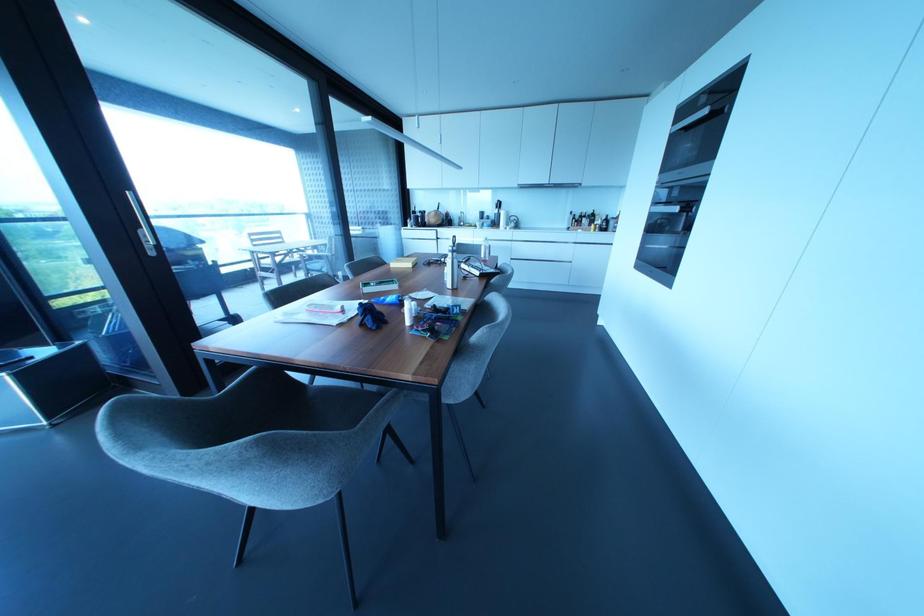
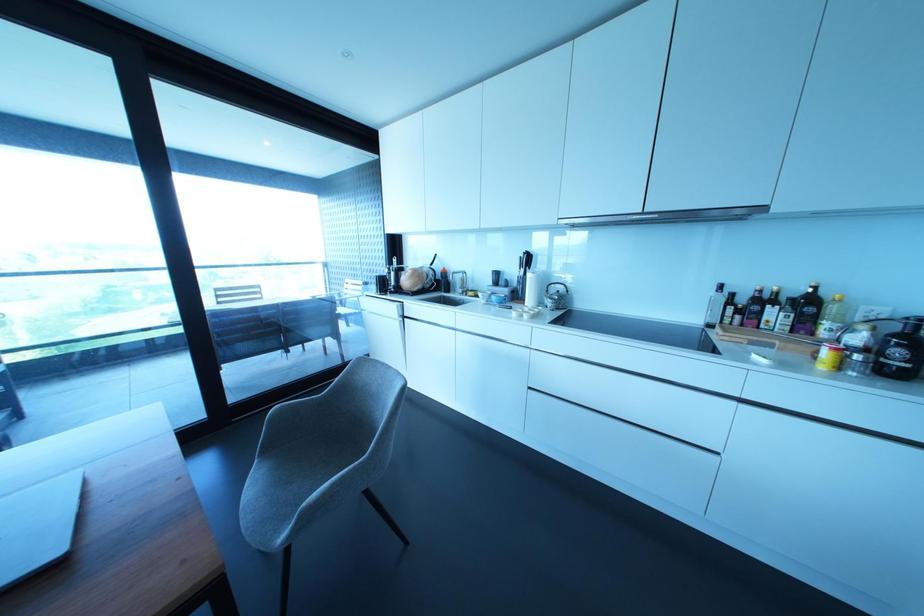
The point at [594,222] is marked in the first image. Where is the corresponding point in the second image?

(825, 323)